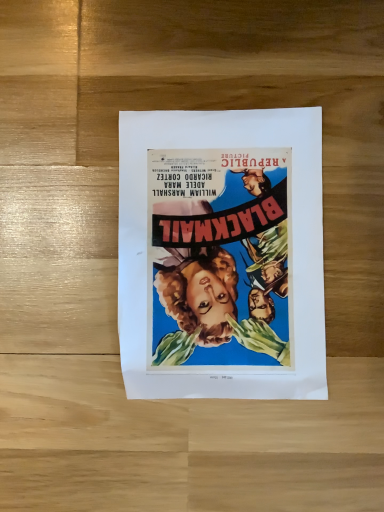
You are a GUI agent. You are given a task and a screenshot of the screen. Output one action in this format:
    pyautogui.click(x=<x>, y=<y>)
    Task: Click on the blank space situated above matte paper poster at center (from a real-world perspective)
    This screenshot has height=512, width=384.
    Given the screenshot: What is the action you would take?
    pyautogui.click(x=218, y=242)